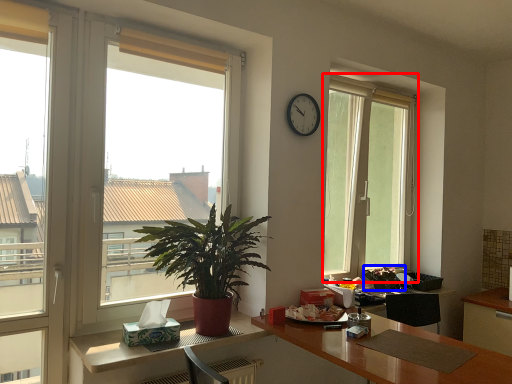
Question: Which object is further to the camera taking this photo, window (highlighted by a red box) or houseplant (highlighted by a blue box)?

Choices:
 (A) window
 (B) houseplant

Answer: (B)